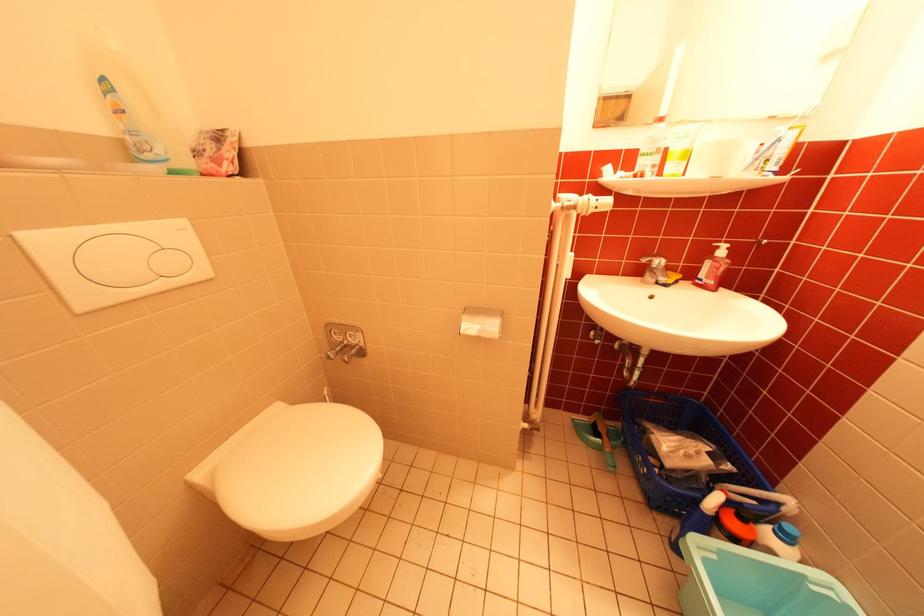
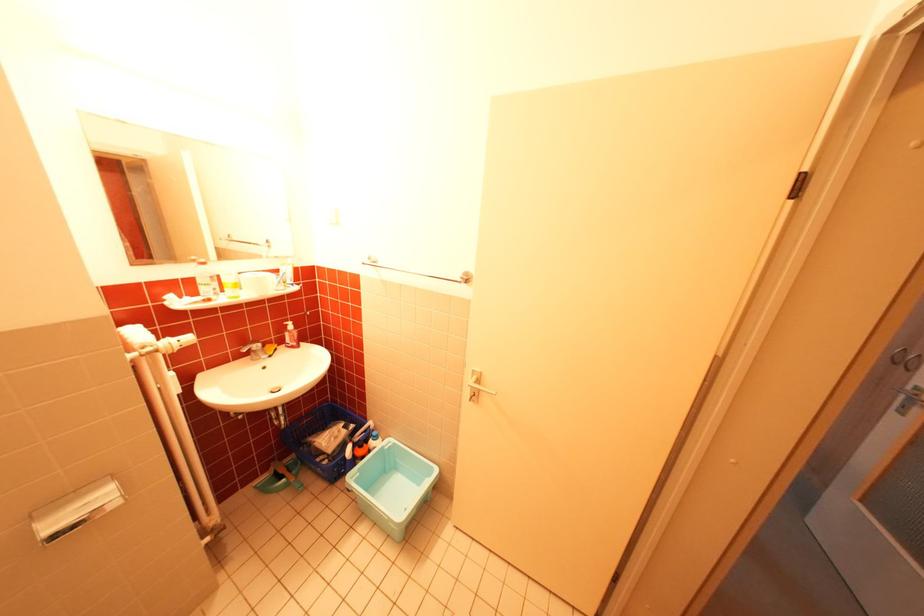
The point at [713,277] is marked in the first image. Where is the corresponding point in the second image?

(298, 342)